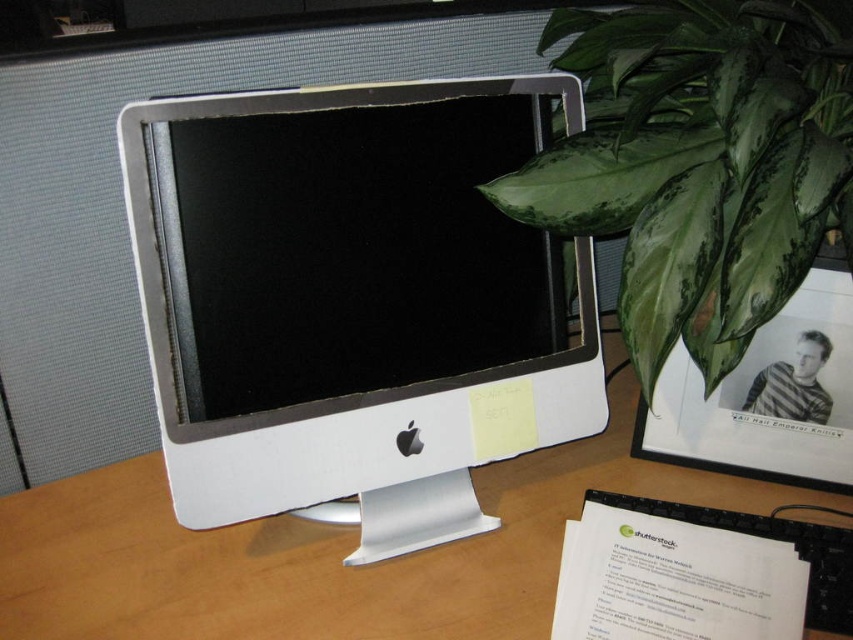
Question: Which point is farther to the camera?

Choices:
 (A) (724, 438)
 (B) (828, 154)

Answer: (A)

Question: From the image, what is the correct spatial relationship of green glossy leaf at upper right in relation to white plastic computer monitor at center?

Choices:
 (A) left
 (B) right

Answer: (A)

Question: Does white plastic desktop computer at center appear over white plastic computer monitor at center?

Choices:
 (A) no
 (B) yes

Answer: (B)

Question: Which of the following is the farthest from the observer?

Choices:
 (A) white plastic computer monitor at center
 (B) white plastic desktop computer at center
 (C) green glossy leaf at upper right

Answer: (A)

Question: Can you confirm if white plastic desktop computer at center is thinner than green glossy leaf at upper right?

Choices:
 (A) yes
 (B) no

Answer: (B)

Question: Which object is the closest to the white plastic desktop computer at center?

Choices:
 (A) green glossy leaf at upper right
 (B) white plastic computer monitor at center

Answer: (A)